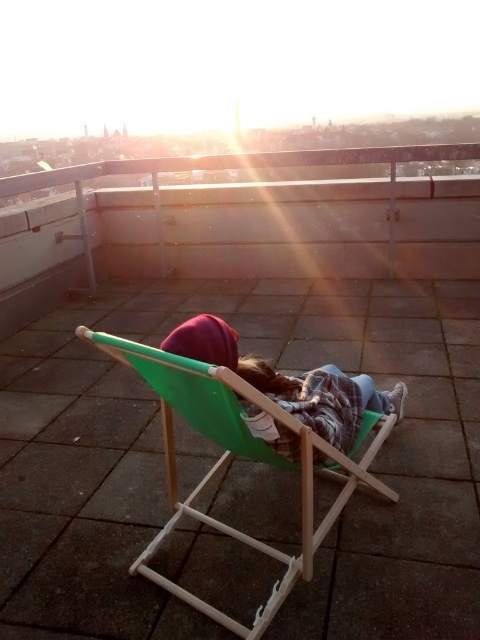
Is the position of green wood beach chair at center less distant than that of matte green chair at center?

Yes.

Can you confirm if green wood beach chair at center is shorter than matte green chair at center?

No.

Which is in front, point (243, 387) or point (350, 385)?

Point (243, 387) is more forward.

This screenshot has width=480, height=640. I want to click on green wood beach chair at center, so click(x=232, y=458).